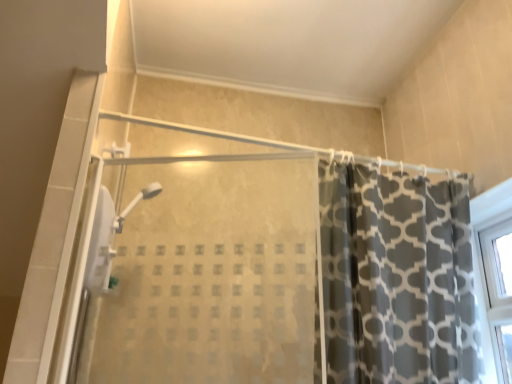
Question: In the image, is transparent glass shower door at center positioned in front of or behind dark gray printed fabric curtain at right?

Choices:
 (A) front
 (B) behind

Answer: (A)

Question: From the image's perspective, relative to dark gray printed fabric curtain at right, is transparent glass shower door at center above or below?

Choices:
 (A) below
 (B) above

Answer: (B)

Question: Based on their sizes in the image, would you say transparent glass shower door at center is bigger or smaller than dark gray printed fabric curtain at right?

Choices:
 (A) small
 (B) big

Answer: (A)

Question: Looking at their shapes, would you say dark gray printed fabric curtain at right is wider or thinner than transparent glass shower door at center?

Choices:
 (A) thin
 (B) wide

Answer: (B)

Question: In terms of size, does dark gray printed fabric curtain at right appear bigger or smaller than transparent glass shower door at center?

Choices:
 (A) big
 (B) small

Answer: (A)

Question: Is dark gray printed fabric curtain at right inside or outside of transparent glass shower door at center?

Choices:
 (A) inside
 (B) outside

Answer: (B)

Question: Considering the positions of dark gray printed fabric curtain at right and transparent glass shower door at center in the image, is dark gray printed fabric curtain at right taller or shorter than transparent glass shower door at center?

Choices:
 (A) tall
 (B) short

Answer: (A)